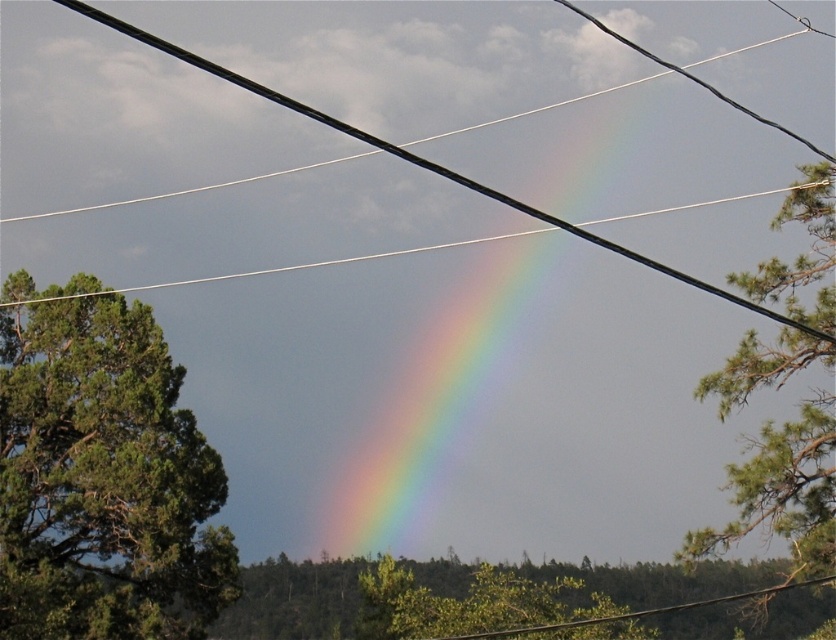
You are standing in a forest and see the green leafy tree at lower center and the black wire at center. Which object is positioned to the right side from your perspective?

The green leafy tree at lower center is positioned to the right of the black wire at center.

You are a hiker who wants to take a photo of the rainbow while staying safe. You notice the green leafy tree at right and the black wire at center. How far apart are these two objects from each other?

The green leafy tree at right is 24.52 meters away from the black wire at center.

You are a bird looking for a place to perch. You see the green leafy tree at right and the black wire at center. Which option would allow you to perch higher above the ground?

The black wire at center is larger in size than the green leafy tree at right, so perching on the black wire at center would place you higher above the ground.